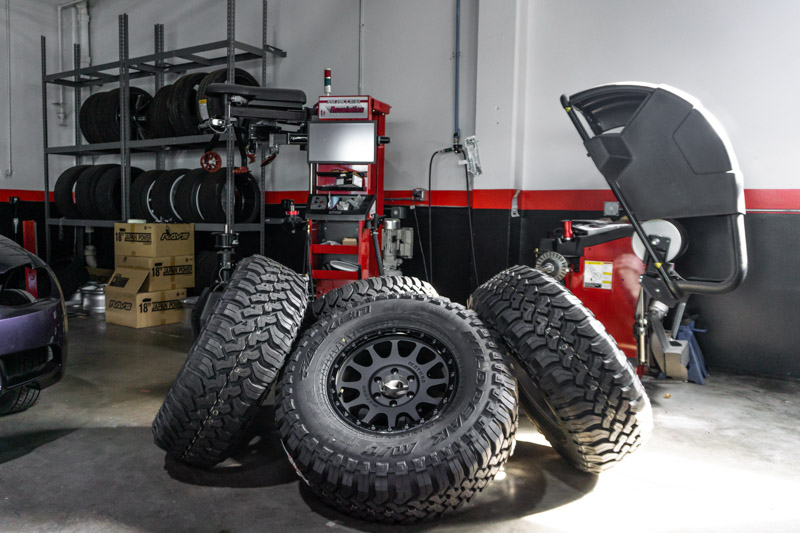
Locate an element on the screen. This screenshot has height=533, width=800. floor is located at coordinates (114, 464).